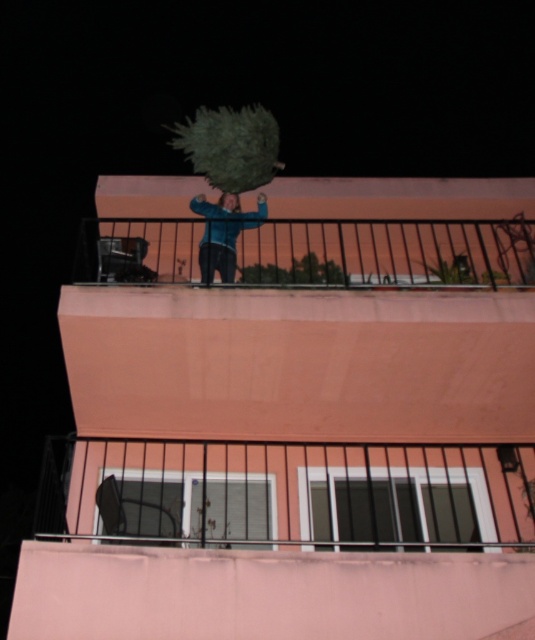
You are a delivery drone trying to land on the balcony. The metallic balcony railing at upper center and the blue denim jacket at center are in your path. Which object should you avoid first to safely navigate to the landing spot?

The metallic balcony railing at upper center is positioned under the blue denim jacket at center, so you should avoid the blue denim jacket at center first as it is above the railing and closer to your flight path.

You are standing 20 feet away from the balcony where the person is holding the green matte tree at center. Can you safely approach the balcony without entering the building?

The green matte tree at center is 21.05 feet away from the viewer. Since you are standing 20 feet away from the balcony, you are closer than the tree, so you can safely approach the balcony without entering the building.